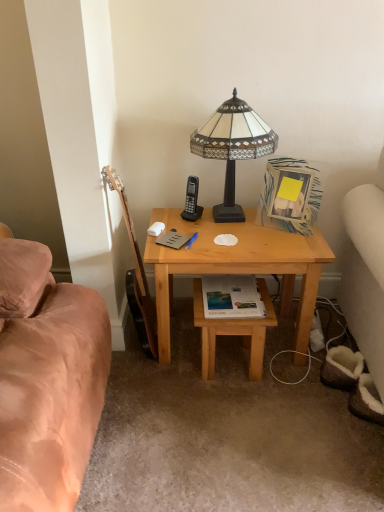
The width and height of the screenshot is (384, 512). I want to click on vacant space underneath stained glass lampshade at upper center (from a real-world perspective), so pyautogui.click(x=235, y=215).